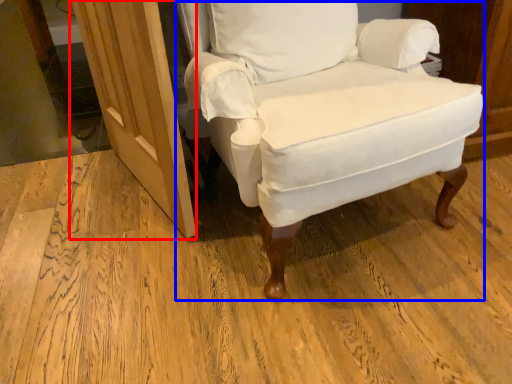
Question: Among these objects, which one is nearest to the camera, screen door (highlighted by a red box) or chair (highlighted by a blue box)?

Choices:
 (A) screen door
 (B) chair

Answer: (B)